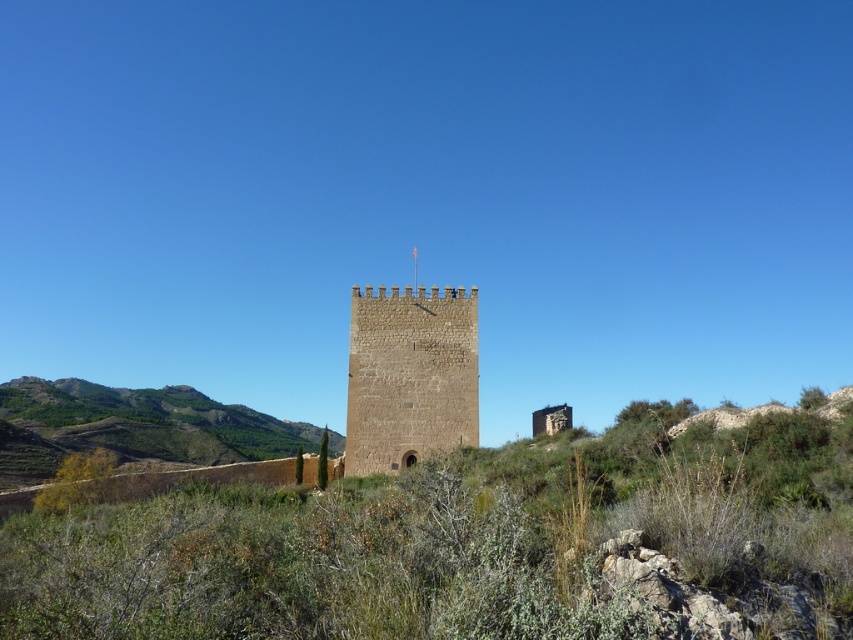
How much distance is there between green shrubs at center and brown stone tower at center?

green shrubs at center is 82.17 feet away from brown stone tower at center.

Between green shrubs at center and brown stone tower at center, which one is positioned higher?

brown stone tower at center is higher up.

The image size is (853, 640). Describe the element at coordinates (471, 545) in the screenshot. I see `green shrubs at center` at that location.

Locate an element on the screen. green shrubs at center is located at coordinates (471, 545).

Who is lower down, brown stone tower at center or green grassy hillside at lower left?

Positioned lower is green grassy hillside at lower left.

Who is more distant from viewer, (363, 451) or (131, 420)?

The point (131, 420) is more distant.

Describe the element at coordinates (409, 376) in the screenshot. I see `brown stone tower at center` at that location.

At what (x,y) coordinates should I click in order to perform the action: click on brown stone tower at center. Please return your answer as a coordinate pair (x, y). Looking at the image, I should click on (409, 376).

Does green shrubs at center have a greater height compared to green grassy hillside at lower left?

Correct, green shrubs at center is much taller as green grassy hillside at lower left.

Is green shrubs at center bigger than green grassy hillside at lower left?

Indeed, green shrubs at center has a larger size compared to green grassy hillside at lower left.

The image size is (853, 640). What do you see at coordinates (471, 545) in the screenshot? I see `green shrubs at center` at bounding box center [471, 545].

Image resolution: width=853 pixels, height=640 pixels. What are the coordinates of `green shrubs at center` in the screenshot? It's located at (471, 545).